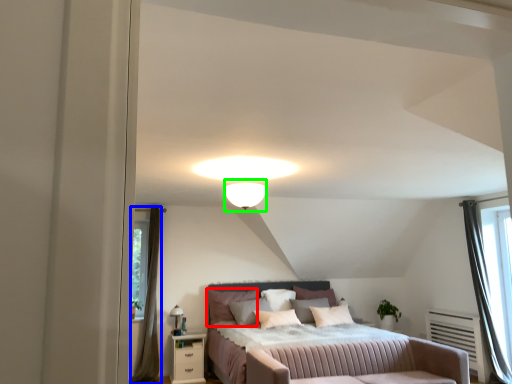
Question: Which object is positioned farthest from pillow (highlighted by a red box)? Select from curtain (highlighted by a blue box) and lighting (highlighted by a green box).

Choices:
 (A) curtain
 (B) lighting

Answer: (B)